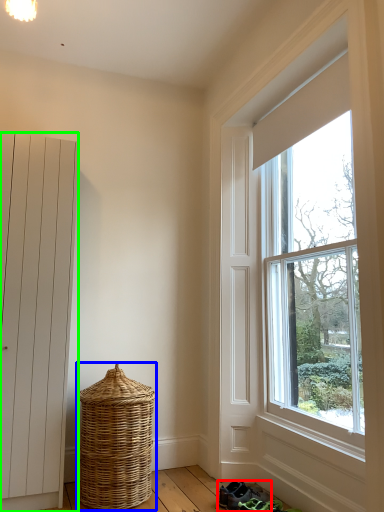
Question: Which object is positioned farthest from footwear (highlighted by a red box)? Select from basket (highlighted by a blue box) and door (highlighted by a green box).

Choices:
 (A) basket
 (B) door

Answer: (B)